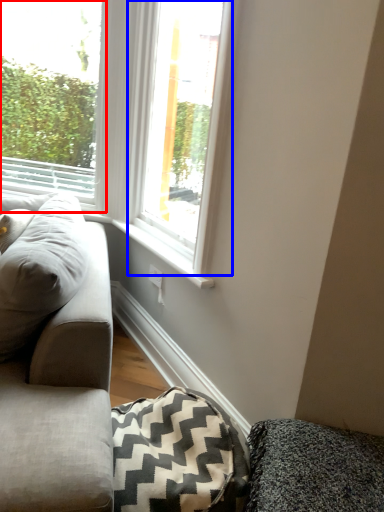
Question: Which point is closer to the camera, window (highlighted by a red box) or window (highlighted by a blue box)?

Choices:
 (A) window
 (B) window

Answer: (B)